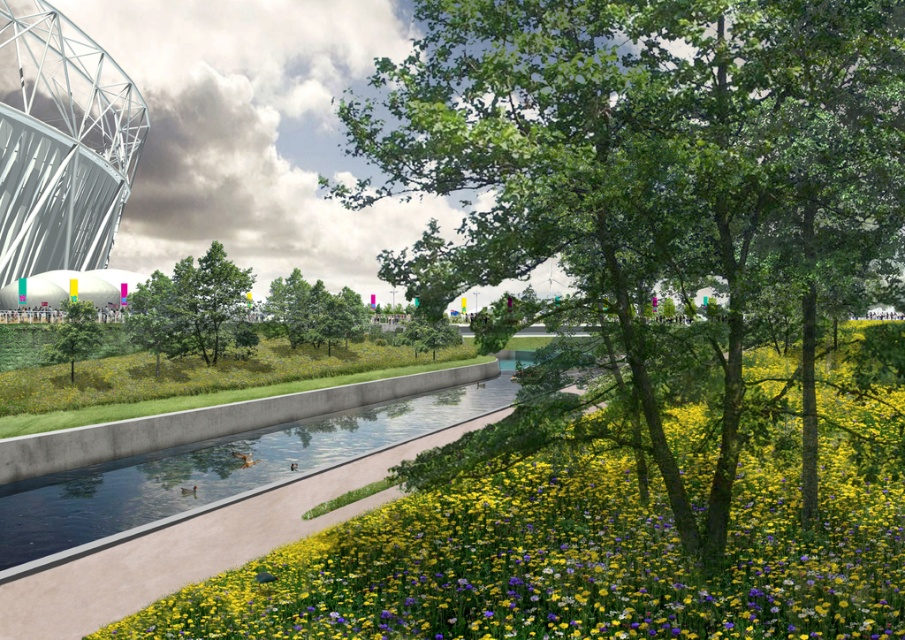
You are standing in the meadow and want to walk towards the stadium. Which point, point (262, 448) or point (286, 310), would you reach first?

Point (262, 448) is closer to the viewer than point (286, 310), so you would reach point (262, 448) first.

You are standing at the point labeled as point (x=313, y=312) in the image. Looking around, you see a green matte tree at center. What is the nearest object to you?

The nearest object to you is the green matte tree at center since the point (x=313, y=312) corresponds to it.

You are a landscape designer planning to place a small statue between the yellow matte flower at center and the green leafy tree at center. Given their sizes, which object should the statue be closer to to maintain balance?

The yellow matte flower at center is wider than the green leafy tree at center. To maintain balance, the statue should be placed closer to the yellow matte flower at center since it is larger and requires more space.